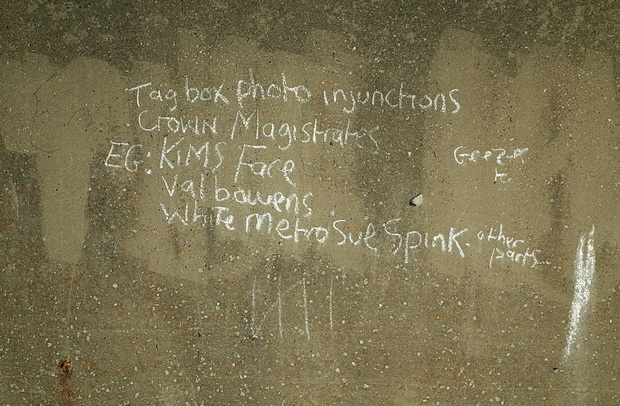
This screenshot has height=406, width=620. Identify the location of concrete wall. (143, 333).